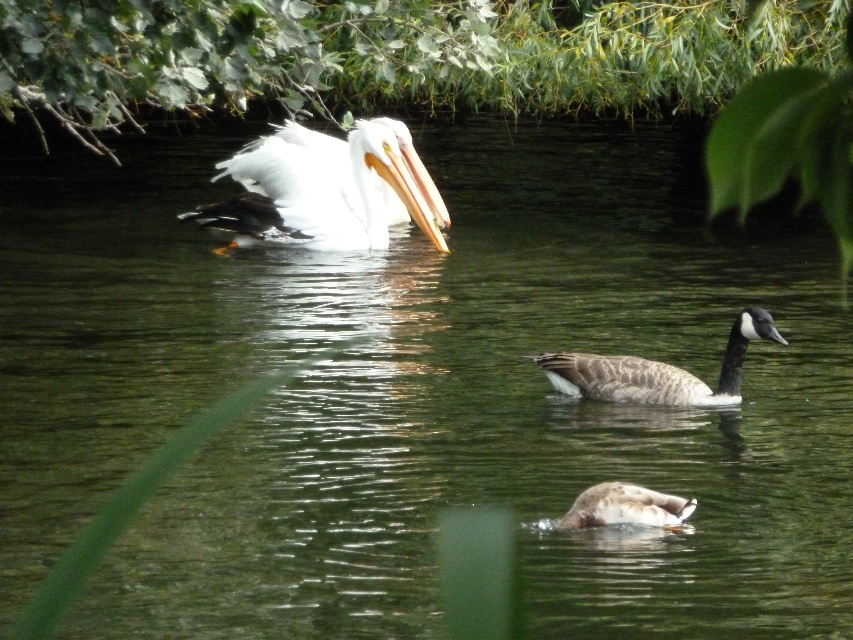
Consider the image. You are a wildlife photographer aiming to capture the white glossy pelican at upper left in your shot. Based on its coordinates, where should you position your camera to ensure it is centered in the frame?

The white glossy pelican at upper left is located at point (317,193), so you should position your camera to center the pelican at those coordinates.

You are a photographer trying to capture the brown matte duck at center and the white smooth beak at center in a single frame. Based on their sizes in the image, which one would you need to zoom in closer to include fully in the photo?

The white smooth beak at center occupies more space in the image than the brown matte duck at center, so you would need to zoom in closer to include the brown matte duck at center fully in the photo.